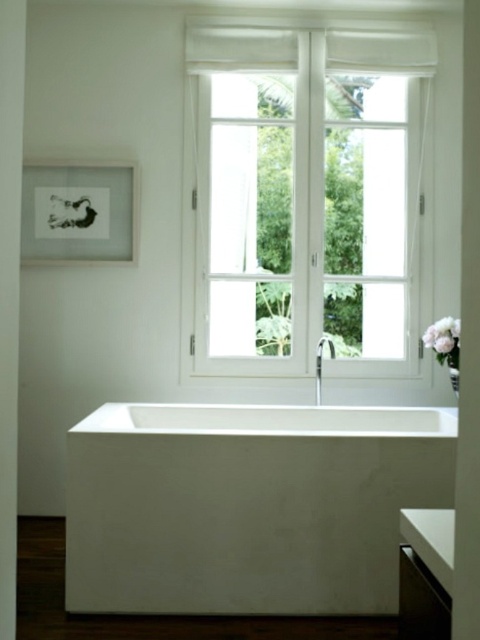
Based on the photo, who is more forward, (x=163, y=534) or (x=433, y=328)?

Positioned in front is point (x=163, y=534).

Which is behind, point (183, 563) or point (456, 340)?

Positioned behind is point (456, 340).

Identify the location of white smooth bathtub at center. This screenshot has height=640, width=480. (248, 506).

This screenshot has height=640, width=480. In order to click on white smooth bathtub at center in this screenshot , I will do click(248, 506).

You are a GUI agent. You are given a task and a screenshot of the screen. Output one action in this format:
    pyautogui.click(x=<x>, y=<y>)
    Task: Click on the white glass window at center
    
    Given the screenshot: What is the action you would take?
    pyautogui.click(x=304, y=196)

Find the location of a particular element. white glass window at center is located at coordinates (304, 196).

Is matte black picture frame at upper left shorter than white matte flower at right?

Incorrect, matte black picture frame at upper left's height does not fall short of white matte flower at right's.

Looking at this image, who is taller, matte black picture frame at upper left or white matte flower at right?

matte black picture frame at upper left is taller.

Is point (132, 221) farther from camera compared to point (456, 337)?

Yes, it is behind point (456, 337).

The height and width of the screenshot is (640, 480). In order to click on matte black picture frame at upper left in this screenshot , I will do `click(79, 212)`.